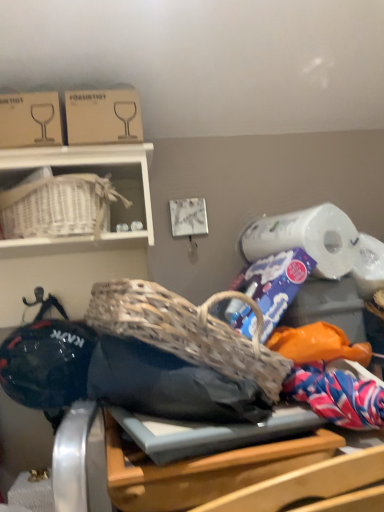
Question: Considering the relative sizes of cardboard box at upper left, positioned as the 2th cardboard box in left-to-right order, and wooden table at center in the image provided, is cardboard box at upper left, positioned as the 2th cardboard box in left-to-right order, thinner than wooden table at center?

Choices:
 (A) no
 (B) yes

Answer: (B)

Question: Is cardboard box at upper left, which ranks as the 1th cardboard box in right-to-left order, completely or partially outside of wooden table at center?

Choices:
 (A) yes
 (B) no

Answer: (A)

Question: Can you confirm if cardboard box at upper left, which ranks as the 1th cardboard box in right-to-left order, is wider than wooden table at center?

Choices:
 (A) yes
 (B) no

Answer: (B)

Question: Are cardboard box at upper left, positioned as the 2th cardboard box in left-to-right order, and wooden table at center making contact?

Choices:
 (A) no
 (B) yes

Answer: (A)

Question: Is cardboard box at upper left, positioned as the 2th cardboard box in left-to-right order, positioned with its back to wooden table at center?

Choices:
 (A) no
 (B) yes

Answer: (A)

Question: Considering the relative positions of cardboard box at upper left, positioned as the 2th cardboard box in left-to-right order, and wooden table at center in the image provided, is cardboard box at upper left, positioned as the 2th cardboard box in left-to-right order, behind wooden table at center?

Choices:
 (A) yes
 (B) no

Answer: (A)

Question: From the image's perspective, is cardboard box at upper left, the 1th cardboard box from the left, located beneath cardboard box at upper left, which ranks as the 1th cardboard box in right-to-left order?

Choices:
 (A) yes
 (B) no

Answer: (A)

Question: Does cardboard box at upper left, the 1th cardboard box from the left, have a smaller size compared to cardboard box at upper left, which ranks as the 1th cardboard box in right-to-left order?

Choices:
 (A) yes
 (B) no

Answer: (A)

Question: Is cardboard box at upper left, which ranks as the 1th cardboard box in right-to-left order, inside cardboard box at upper left, arranged as the 2th cardboard box when viewed from the right?

Choices:
 (A) yes
 (B) no

Answer: (B)

Question: Is cardboard box at upper left, the 1th cardboard box from the left, facing towards cardboard box at upper left, positioned as the 2th cardboard box in left-to-right order?

Choices:
 (A) no
 (B) yes

Answer: (A)

Question: From the image's perspective, is cardboard box at upper left, arranged as the 2th cardboard box when viewed from the right, on cardboard box at upper left, which ranks as the 1th cardboard box in right-to-left order?

Choices:
 (A) yes
 (B) no

Answer: (B)

Question: Is cardboard box at upper left, the 1th cardboard box from the left, positioned beyond the bounds of cardboard box at upper left, positioned as the 2th cardboard box in left-to-right order?

Choices:
 (A) no
 (B) yes

Answer: (B)

Question: Does cardboard box at upper left, positioned as the 2th cardboard box in left-to-right order, have a lesser height compared to cardboard box at upper left, the 1th cardboard box from the left?

Choices:
 (A) yes
 (B) no

Answer: (A)